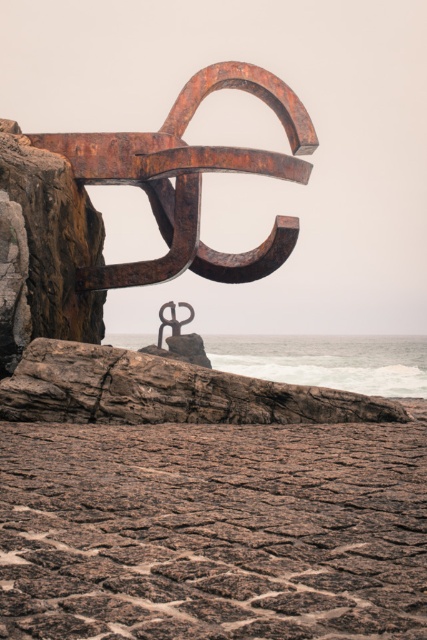
Question: Which of the following is the closest to the observer?

Choices:
 (A) rusty metal anchor at center
 (B) rusty stone beach at lower center

Answer: (B)

Question: Does rusty stone beach at lower center have a smaller size compared to rusty metal anchor at center?

Choices:
 (A) no
 (B) yes

Answer: (A)

Question: Does rusty stone beach at lower center have a larger size compared to rusty metal anchor at center?

Choices:
 (A) no
 (B) yes

Answer: (B)

Question: Can you confirm if rusty stone beach at lower center is thinner than rusty metal anchor at center?

Choices:
 (A) yes
 (B) no

Answer: (B)